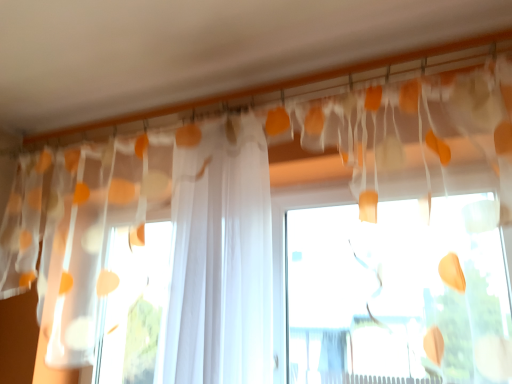
Image resolution: width=512 pixels, height=384 pixels. What do you see at coordinates (220, 261) in the screenshot?
I see `translucent white curtain at center` at bounding box center [220, 261].

Measure the distance between translucent white curtain at center and camera.

The depth of translucent white curtain at center is 1.27 meters.

Find the location of a particular element. The image size is (512, 384). translucent white curtain at center is located at coordinates (220, 261).

Find the location of a particular element. translucent white curtain at center is located at coordinates (220, 261).